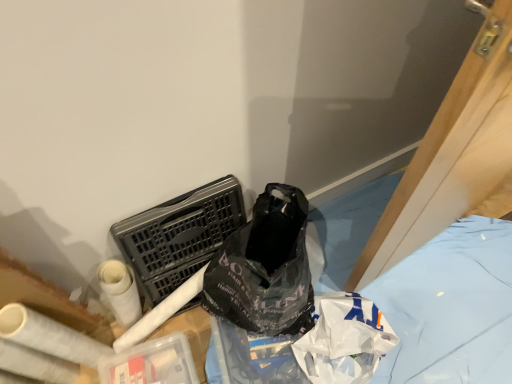
Locate an element on the screen. The height and width of the screenshot is (384, 512). black plastic laundry basket at center-left is located at coordinates (179, 235).

The image size is (512, 384). Describe the element at coordinates (451, 307) in the screenshot. I see `black plastic bag at lower right` at that location.

This screenshot has width=512, height=384. I want to click on black plastic laundry basket at center-left, so click(179, 235).

From a real-world perspective, does black plastic bag at lower right sit lower than white matte toilet paper at lower left?

Yes, from a real-world perspective, black plastic bag at lower right is under white matte toilet paper at lower left.

In the scene shown: Can you tell me how much black plastic bag at lower right and white matte toilet paper at lower left differ in facing direction?

The facing directions of black plastic bag at lower right and white matte toilet paper at lower left are 1.77 degrees apart.

The image size is (512, 384). I want to click on sheet behind the white matte toilet paper at lower left, so click(451, 307).

Relative to white matte toilet paper at lower left, is black plastic bag at lower right in front or behind?

black plastic bag at lower right is positioned farther from the viewer than white matte toilet paper at lower left.

Which is less distant, (175, 252) or (96, 364)?

The point (96, 364) is closer.

Is black plastic laundry basket at center-left outside of white matte toilet paper at lower left?

That's correct, black plastic laundry basket at center-left is outside of white matte toilet paper at lower left.

Considering their positions, is black plastic laundry basket at center-left located in front of or behind white matte toilet paper at lower left?

Visually, black plastic laundry basket at center-left is located behind white matte toilet paper at lower left.

Is white matte toilet paper at lower left wider or thinner than black plastic laundry basket at center-left?

Clearly, white matte toilet paper at lower left has less width compared to black plastic laundry basket at center-left.

Do you think white matte toilet paper at lower left is within black plastic laundry basket at center-left, or outside of it?

white matte toilet paper at lower left is located beyond the bounds of black plastic laundry basket at center-left.

Is white matte toilet paper at lower left far away from black plastic laundry basket at center-left?

No, there isn't a large distance between white matte toilet paper at lower left and black plastic laundry basket at center-left.

Is point (488, 333) closer or farther from the camera than point (170, 227)?

Point (488, 333) appears to be farther away from the viewer than point (170, 227).

Between black plastic bag at lower right and black plastic laundry basket at center-left, which one is positioned behind?

black plastic bag at lower right.

Measure the distance from black plastic bag at lower right to black plastic laundry basket at center-left.

28.93 inches.

What's the angular difference between black plastic laundry basket at center-left and black plastic bag at lower right's facing directions?

79 degrees separate the facing orientations of black plastic laundry basket at center-left and black plastic bag at lower right.

From their relative heights in the image, would you say black plastic laundry basket at center-left is taller or shorter than black plastic bag at lower right?

black plastic laundry basket at center-left is taller than black plastic bag at lower right.

Does point (133, 228) lie in front of point (401, 310)?

Yes, point (133, 228) is closer to viewer.

Is there a large distance between black plastic laundry basket at center-left and black plastic bag at lower right?

They are positioned close to each other.

Consider the image. From a real-world perspective, is white matte toilet paper at lower left located beneath black plastic bag at lower right?

No, from a real-world perspective, white matte toilet paper at lower left is not under black plastic bag at lower right.

At what (x,y) coordinates should I click in order to perform the action: click on toilet paper above the black plastic bag at lower right (from the image's perspective). Please return your answer as a coordinate pair (x, y). Looking at the image, I should click on (49, 336).

Visually, is white matte toilet paper at lower left positioned to the left or to the right of black plastic bag at lower right?

white matte toilet paper at lower left is to the left of black plastic bag at lower right.

What's the angular difference between white matte toilet paper at lower left and black plastic bag at lower right's facing directions?

The facing directions of white matte toilet paper at lower left and black plastic bag at lower right are 1.77 degrees apart.

You are a GUI agent. You are given a task and a screenshot of the screen. Output one action in this format:
    pyautogui.click(x=<x>, y=<y>)
    Task: Click on the sheet that is behind the white matte toilet paper at lower left
    
    Given the screenshot: What is the action you would take?
    [451, 307]

What are the coordinates of `toilet paper that appears on the left of black plastic laundry basket at center-left` in the screenshot? It's located at (49, 336).

Considering their positions, is black plastic bag at lower right positioned further to white matte toilet paper at lower left than black plastic laundry basket at center-left?

black plastic bag at lower right is further to white matte toilet paper at lower left.

Based on their spatial positions, is black plastic bag at lower right or white matte toilet paper at lower left further from black plastic laundry basket at center-left?

black plastic bag at lower right is further to black plastic laundry basket at center-left.

Estimate the real-world distances between objects in this image. Which object is closer to black plastic laundry basket at center-left, white matte toilet paper at lower left or black plastic bag at lower right?

white matte toilet paper at lower left is closer to black plastic laundry basket at center-left.

Looking at the image, which one is located closer to black plastic bag at lower right, white matte toilet paper at lower left or black plastic laundry basket at center-left?

Based on the image, black plastic laundry basket at center-left appears to be nearer to black plastic bag at lower right.

When comparing their distances from black plastic bag at lower right, does black plastic laundry basket at center-left or white matte toilet paper at lower left seem closer?

black plastic laundry basket at center-left lies closer to black plastic bag at lower right than the other object.

When comparing their distances from white matte toilet paper at lower left, does black plastic laundry basket at center-left or black plastic bag at lower right seem further?

black plastic bag at lower right lies further to white matte toilet paper at lower left than the other object.

The width and height of the screenshot is (512, 384). Identify the location of laundry basket situated between white matte toilet paper at lower left and black plastic bag at lower right from left to right. (179, 235).